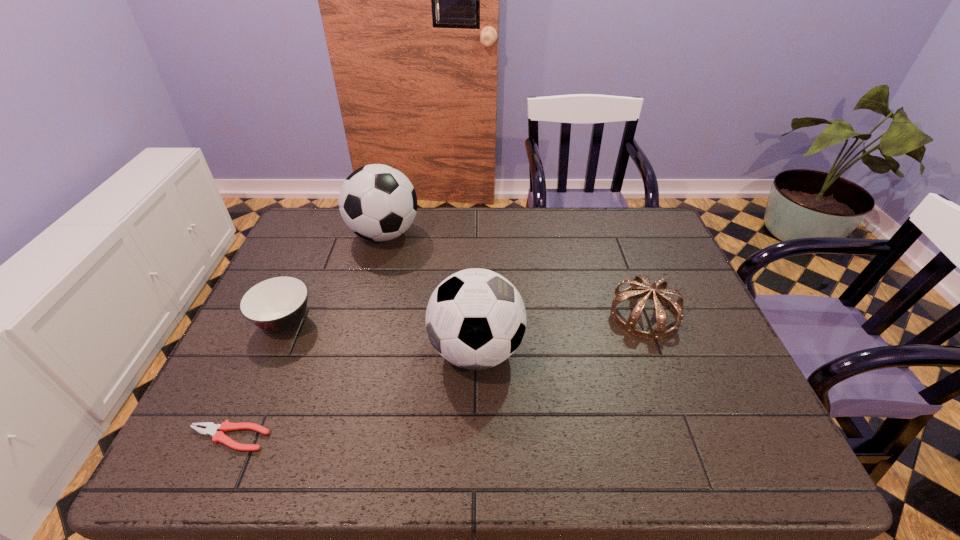
Find the location of `vacant point located 0.320m on the main logo of the second object from right to left`. vacant point located 0.320m on the main logo of the second object from right to left is located at coordinates (656, 350).

Identify the location of vacant area located 0.320m on the left of the rightmost object. (487, 315).

Image resolution: width=960 pixels, height=540 pixels. I want to click on vacant space located on the back of the soup bowl, so click(306, 273).

The image size is (960, 540). What are the coordinates of `vacant area located 0.260m on the back of the shortest object` in the screenshot? It's located at [x=277, y=329].

This screenshot has height=540, width=960. In order to click on object located at the far edge in this screenshot , I will do `click(377, 202)`.

You are a GUI agent. You are given a task and a screenshot of the screen. Output one action in this format:
    pyautogui.click(x=<x>, y=<y>)
    Task: Click on the object positioned at the near edge
    The width and height of the screenshot is (960, 540).
    Given the screenshot: What is the action you would take?
    pyautogui.click(x=211, y=429)

The image size is (960, 540). I want to click on soup bowl that is at the left edge, so click(277, 304).

You are a GUI agent. You are given a task and a screenshot of the screen. Output one action in this format:
    pyautogui.click(x=<x>, y=<y>)
    Task: Click on the pliers located in the left edge section of the desktop
    The height and width of the screenshot is (540, 960).
    Given the screenshot: What is the action you would take?
    pyautogui.click(x=211, y=429)

Find the location of a particular element. The width and height of the screenshot is (960, 540). object that is at the right edge is located at coordinates (636, 287).

At what (x,y) coordinates should I click in order to perform the action: click on object that is at the near left corner. Please return your answer as a coordinate pair (x, y). The image size is (960, 540). Looking at the image, I should click on (211, 429).